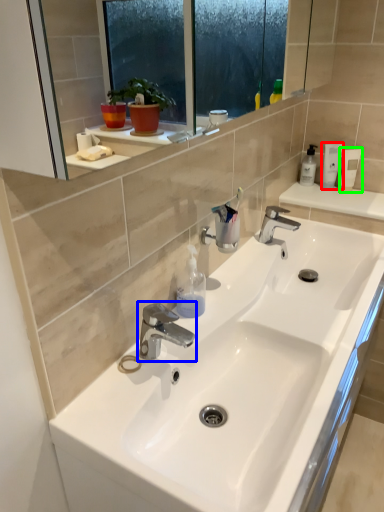
Question: Which object is the farthest from toiletry (highlighted by a red box)? Choose among these: tap (highlighted by a blue box) or mouthwash (highlighted by a green box).

Choices:
 (A) tap
 (B) mouthwash

Answer: (A)